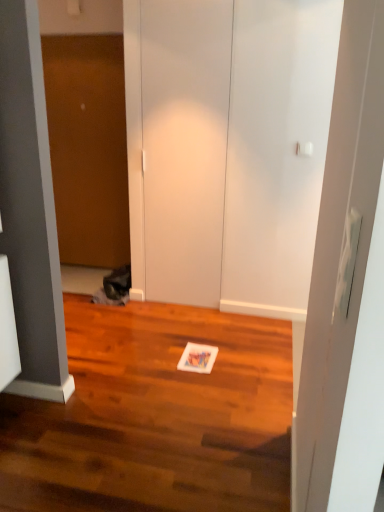
Identify the location of vacant space in front of white matte door at center, acting as the second door starting from the back. This screenshot has height=512, width=384. (186, 324).